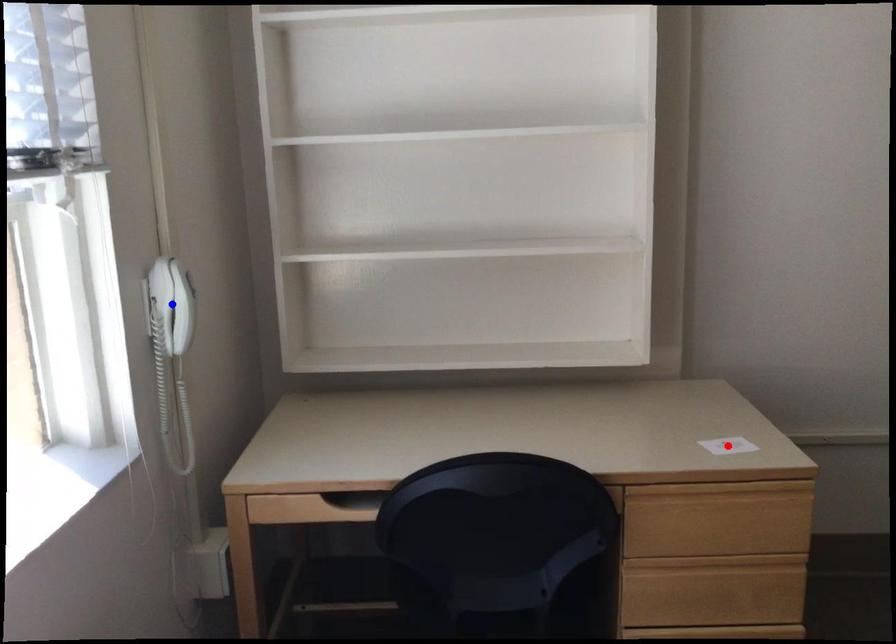
Question: Two points are marked on the image. Which point is closer to the camera?

Choices:
 (A) Blue point is closer.
 (B) Red point is closer.

Answer: (A)